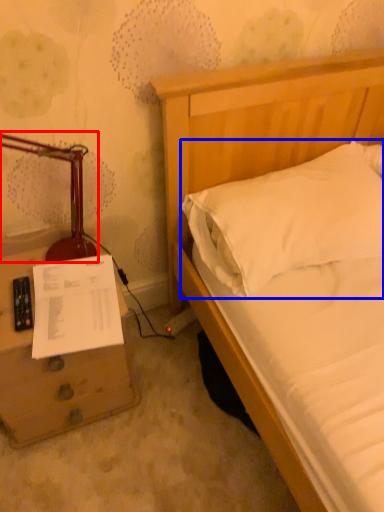
Question: Which of the following is the farthest to the observer, table lamp (highlighted by a red box) or pillow (highlighted by a blue box)?

Choices:
 (A) table lamp
 (B) pillow

Answer: (B)